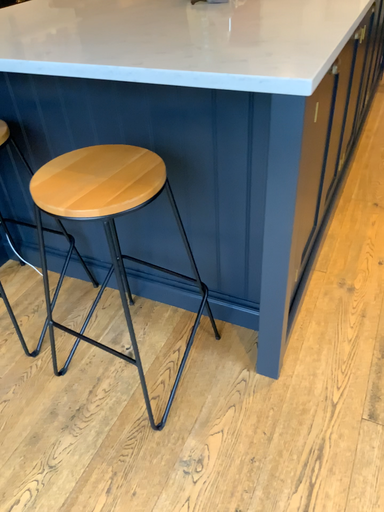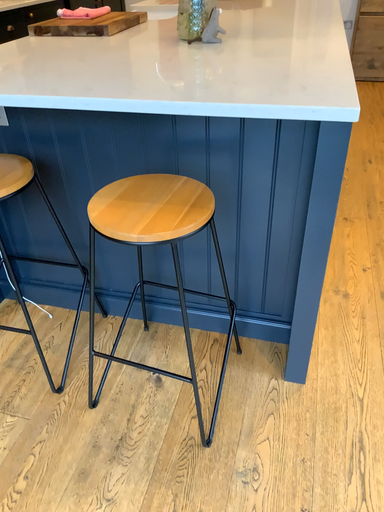
Question: How did the camera likely rotate when shooting the video?

Choices:
 (A) rotated left
 (B) rotated right

Answer: (B)